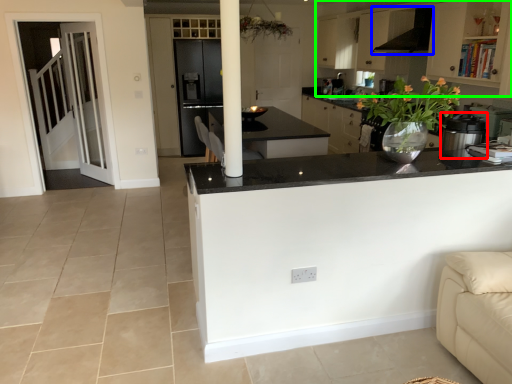
Question: Which is nearer to the kitchen appliance (highlighted by a red box)? exhaust hood (highlighted by a blue box) or cabinetry (highlighted by a green box).

Choices:
 (A) exhaust hood
 (B) cabinetry

Answer: (A)